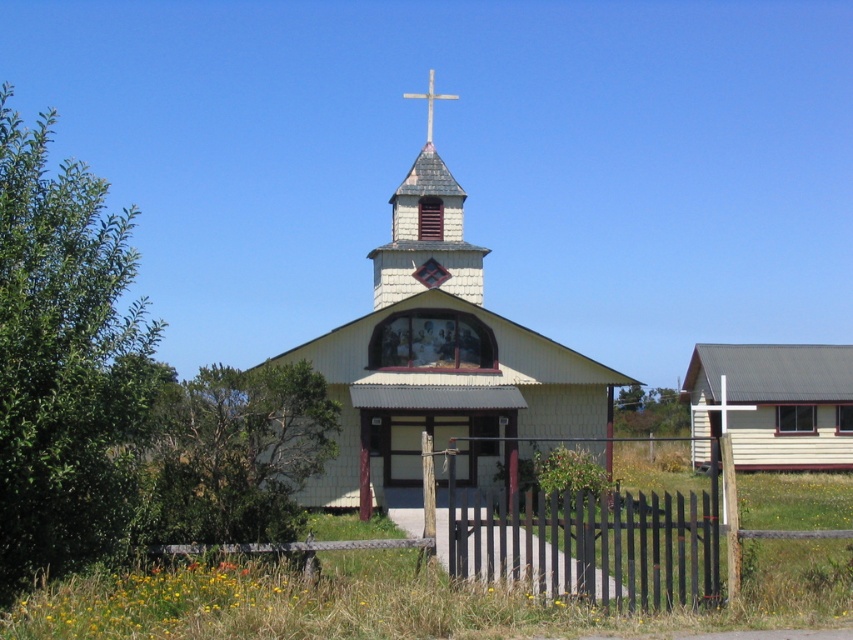
Does point (430, 196) come closer to viewer compared to point (424, 96)?

Yes.

Between wooden shingles at center and wooden cross at upper center, which one appears on the right side from the viewer's perspective?

wooden cross at upper center is more to the right.

Which is in front, point (437, 259) or point (431, 96)?

Positioned in front is point (437, 259).

Locate an element on the screen. The image size is (853, 640). wooden shingles at center is located at coordinates (427, 230).

Is black wood fence at center above wooden cross at upper center?

No.

Can you confirm if black wood fence at center is smaller than wooden cross at upper center?

Correct, black wood fence at center occupies less space than wooden cross at upper center.

Where is `black wood fence at center`? black wood fence at center is located at coordinates (590, 544).

Find the location of a particular element. black wood fence at center is located at coordinates (590, 544).

Does point (410, 164) come farther from viewer compared to point (724, 419)?

Yes, it is.

Is wooden shingles at center to the right of white wooden cross at center from the viewer's perspective?

No, wooden shingles at center is not to the right of white wooden cross at center.

Who is more forward, (389, 259) or (741, 410)?

Point (389, 259) is more forward.

Where is `wooden shingles at center`? wooden shingles at center is located at coordinates (427, 230).